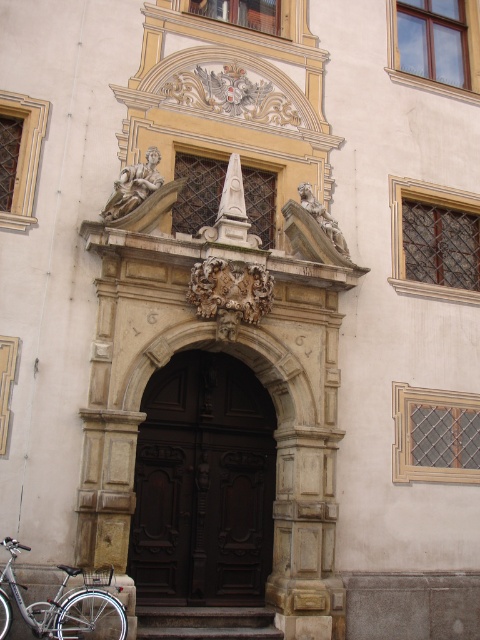
Question: Estimate the real-world distances between objects in this image. Which object is farther from the brown wooden stairs at center?

Choices:
 (A) dark wood door at center
 (B) silver metallic bicycle at lower left

Answer: (A)

Question: Among these points, which one is farthest from the camera?

Choices:
 (A) (223, 381)
 (B) (180, 605)
 (C) (24, 612)

Answer: (A)

Question: Which of the following is the closest to the observer?

Choices:
 (A) (100, 609)
 (B) (225, 611)

Answer: (A)

Question: Does dark wood door at center come in front of brown wooden stairs at center?

Choices:
 (A) yes
 (B) no

Answer: (B)

Question: Can you confirm if dark wood door at center is smaller than silver metallic bicycle at lower left?

Choices:
 (A) yes
 (B) no

Answer: (A)

Question: Is the position of silver metallic bicycle at lower left less distant than that of brown wooden stairs at center?

Choices:
 (A) no
 (B) yes

Answer: (B)